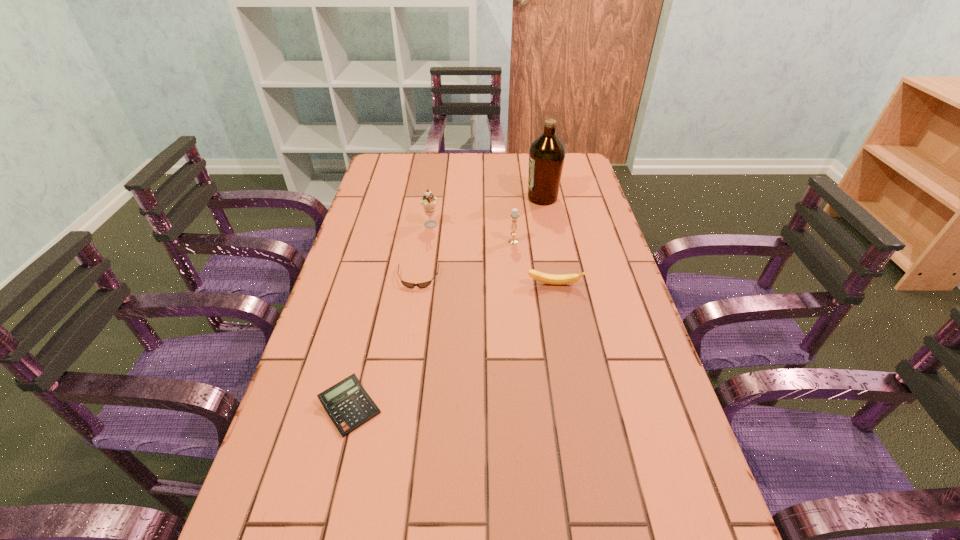
The height and width of the screenshot is (540, 960). I want to click on vacant area located on the label of the olive oil, so click(x=488, y=198).

The height and width of the screenshot is (540, 960). What are the coordinates of `vacant space situated 0.320m on the label of the olive oil` in the screenshot? It's located at (433, 198).

Locate an element on the screen. The height and width of the screenshot is (540, 960). vacant area situated on the label of the olive oil is located at coordinates (419, 198).

Locate an element on the screen. The width and height of the screenshot is (960, 540). vacant space located on the back of the icecream is located at coordinates (434, 206).

Where is `free space located 0.160m on the right of the third object from right to left`? The height and width of the screenshot is (540, 960). free space located 0.160m on the right of the third object from right to left is located at coordinates (571, 241).

Find the location of `vacant position located at the stem of the third shortest object`. vacant position located at the stem of the third shortest object is located at coordinates (566, 354).

The height and width of the screenshot is (540, 960). What are the coordinates of `vacant space located on the right of the calculator` in the screenshot? It's located at (569, 407).

Where is `free space located 0.150m on the front-facing side of the sunglasses`? This screenshot has height=540, width=960. free space located 0.150m on the front-facing side of the sunglasses is located at coordinates (410, 332).

Identify the location of object that is at the left edge. This screenshot has height=540, width=960. (348, 405).

I want to click on olive oil positioned at the right edge, so click(x=547, y=153).